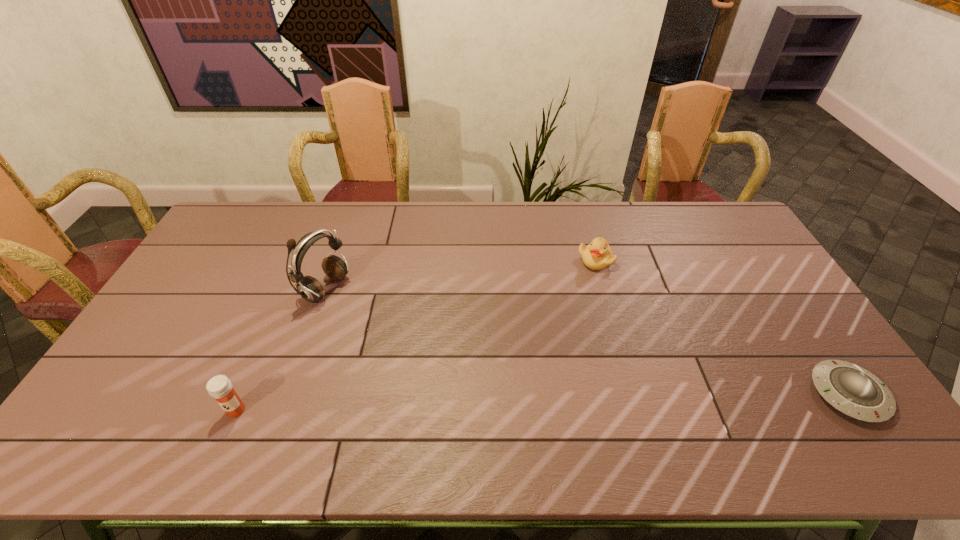
This screenshot has width=960, height=540. Identify the location of the second tallest object. pos(219,387).

This screenshot has height=540, width=960. I want to click on the leftmost object, so click(219, 387).

The image size is (960, 540). In order to click on the rightmost object in this screenshot , I will do `click(856, 392)`.

I want to click on saucer, so click(x=856, y=392).

You are a GUI agent. You are given a task and a screenshot of the screen. Output one action in this format:
    pyautogui.click(x=<x>, y=<y>)
    Task: Click on the third object from right to left
    The height and width of the screenshot is (540, 960).
    Given the screenshot: What is the action you would take?
    pyautogui.click(x=334, y=267)

Image resolution: width=960 pixels, height=540 pixels. What are the coordinates of `earphone` in the screenshot? It's located at (334, 267).

I want to click on the second shortest object, so click(598, 255).

Where is `the third object from left to right`? The height and width of the screenshot is (540, 960). the third object from left to right is located at coordinates [x=598, y=255].

This screenshot has height=540, width=960. I want to click on vacant area situated 0.240m on the back of the saucer, so click(x=784, y=300).

At what (x,y) coordinates should I click in order to perform the action: click on vacant space located 0.250m on the ear pads of the earphone. Please return your answer as a coordinate pair (x, y). Image resolution: width=960 pixels, height=540 pixels. Looking at the image, I should click on (410, 329).